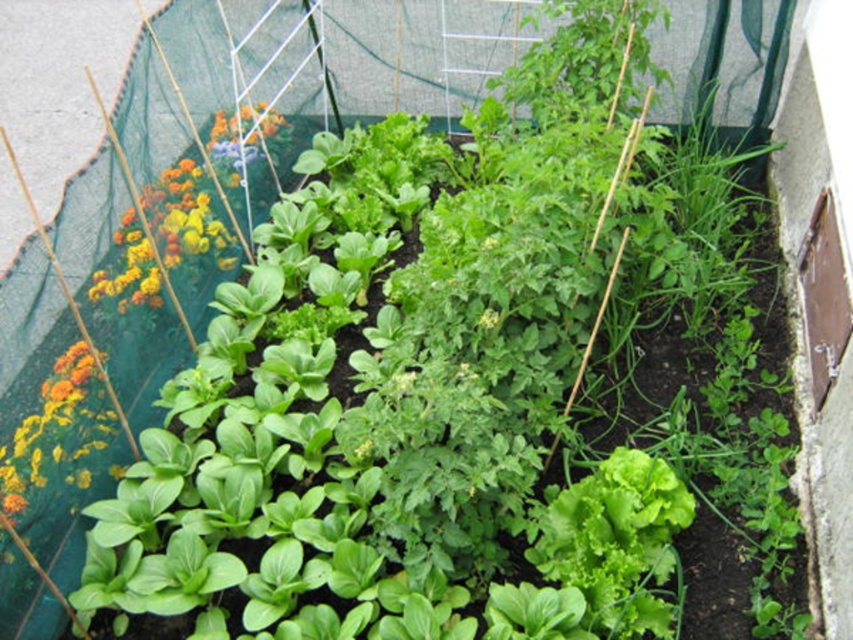
You are a gardener who wants to plant a new row of herbs between the green leafy lettuce at center and the vibrant multicolored flowers at left. Based on their sizes, which plant should you place closer to the smaller one to ensure proper spacing?

The green leafy lettuce at center is smaller than the vibrant multicolored flowers at left, so you should place the herbs closer to the green leafy lettuce at center to maintain appropriate spacing between the plants.

In the scene shown: You are a gardener who wants to plant a new herb that requires full sunlight. You notice the green leafy lettuce at center and the vibrant multicolored flowers at left in the garden bed. Which of these two plants is taller, and why does that matter for choosing where to plant your herb?

The vibrant multicolored flowers at left are taller than the green leafy lettuce at center. Since taller plants can cast shadows, planting the herb that requires full sunlight in a spot where it won not be overshadowed by the flowers is important.

You are a gardener who wants to water the plants in the garden bed. You have a watering can that can reach up to 4 feet. Starting from the vibrant multicolored flowers at left, can you water the green leafy lettuce at center without moving your position?

The green leafy lettuce at center is 4.54 feet away from the vibrant multicolored flowers at left. Since the watering can only reaches up to 4 feet, you cannot water the green leafy lettuce at center without moving your position.